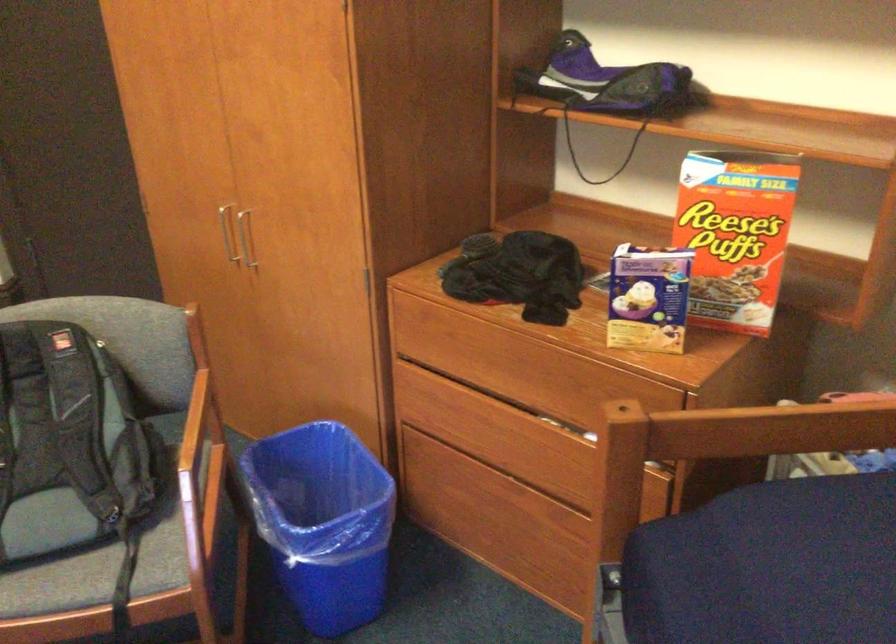
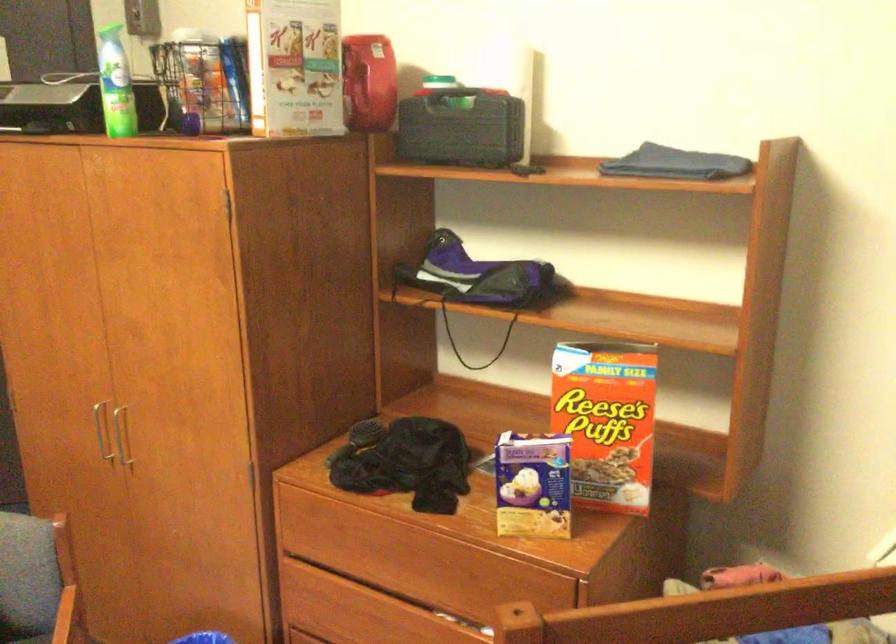
Question: Based on the continuous images, in which direction is the camera rotating? Reply with the corresponding letter.

Choices:
 (A) Left
 (B) Right
 (C) Up
 (D) Down

Answer: (C)